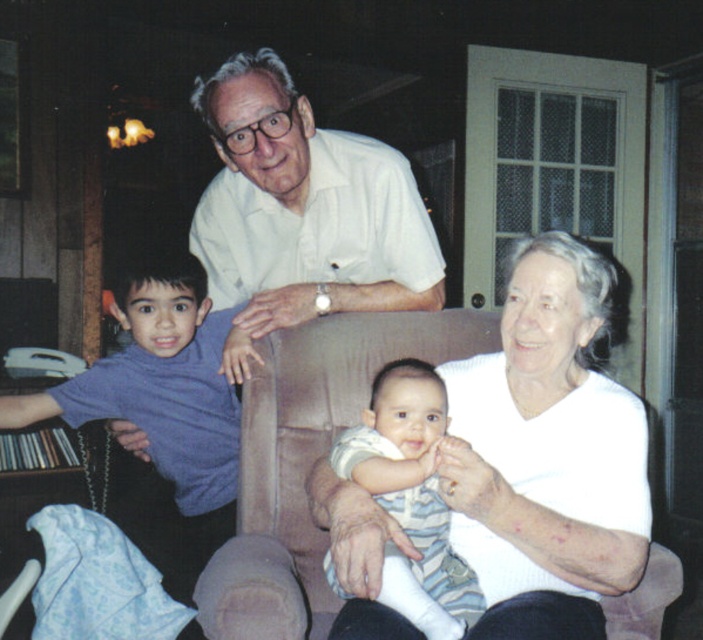
You are standing in the living room and want to hand a gift to the person wearing the white ribbed sweater at center and the person wearing the purple turtleneck shirt at left. Which one can you reach without moving closer?

The white ribbed sweater at center is closer to the viewer than the purple turtleneck shirt at left, so you can reach the person wearing the white ribbed sweater at center without moving closer.

You are a photographer standing in the living room and want to take a closeup photo of the white ribbed sweater at center. The camera you are using has a minimum focusing distance of 1.2 meters. Can you take the photo without moving closer than 1.2 meters?

The white ribbed sweater at center is 1.37 meters from viewer, which is farther than the camera minimum focusing distance of 1.2 meters. Therefore, you can take the photo without moving closer than 1.2 meters.

You are standing in the living room and want to place a small decoration on the point closer to you between the two points marked as point (501, 550) and point (226, 212). Which point should you choose?

You should choose point (501, 550) because it is closer to you than point (226, 212).